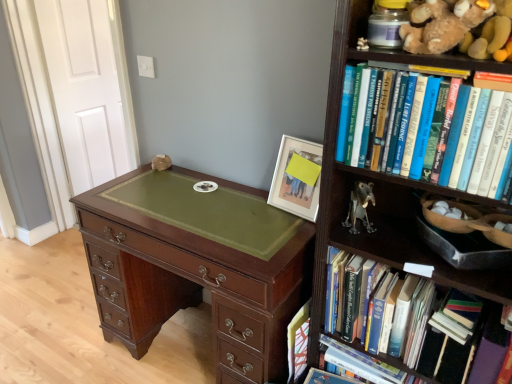
Question: From a real-world perspective, is mahogany wood chest of drawers at center on top of soft brown plush at upper right?

Choices:
 (A) yes
 (B) no

Answer: (B)

Question: Can you confirm if mahogany wood chest of drawers at center is wider than soft brown plush at upper right?

Choices:
 (A) yes
 (B) no

Answer: (A)

Question: Does mahogany wood chest of drawers at center appear on the right side of soft brown plush at upper right?

Choices:
 (A) no
 (B) yes

Answer: (A)

Question: Can you confirm if mahogany wood chest of drawers at center is shorter than soft brown plush at upper right?

Choices:
 (A) no
 (B) yes

Answer: (A)

Question: Is mahogany wood chest of drawers at center smaller than soft brown plush at upper right?

Choices:
 (A) yes
 (B) no

Answer: (B)

Question: Is mahogany wood chest of drawers at center surrounding soft brown plush at upper right?

Choices:
 (A) yes
 (B) no

Answer: (B)

Question: Considering the relative positions of mahogany wood chest of drawers at center and hardcover book at center right, the third book ordered from the bottom, in the image provided, is mahogany wood chest of drawers at center to the left of hardcover book at center right, the third book ordered from the bottom, from the viewer's perspective?

Choices:
 (A) yes
 (B) no

Answer: (A)

Question: From the image's perspective, is mahogany wood chest of drawers at center located beneath hardcover book at center right, the third book ordered from the bottom?

Choices:
 (A) no
 (B) yes

Answer: (B)

Question: Is mahogany wood chest of drawers at center closer to camera compared to hardcover book at center right, placed as the first book when sorted from top to bottom?

Choices:
 (A) no
 (B) yes

Answer: (A)

Question: Is mahogany wood chest of drawers at center with hardcover book at center right, placed as the first book when sorted from top to bottom?

Choices:
 (A) yes
 (B) no

Answer: (B)

Question: Is the position of mahogany wood chest of drawers at center more distant than that of hardcover book at center right, placed as the first book when sorted from top to bottom?

Choices:
 (A) yes
 (B) no

Answer: (A)

Question: Is mahogany wood chest of drawers at center bigger than hardcover book at center right, the third book ordered from the bottom?

Choices:
 (A) yes
 (B) no

Answer: (A)

Question: From a real-world perspective, is metallic gray figurine at center-right positioned over hardcover book at center right, placed as the first book when sorted from top to bottom, based on gravity?

Choices:
 (A) no
 (B) yes

Answer: (A)